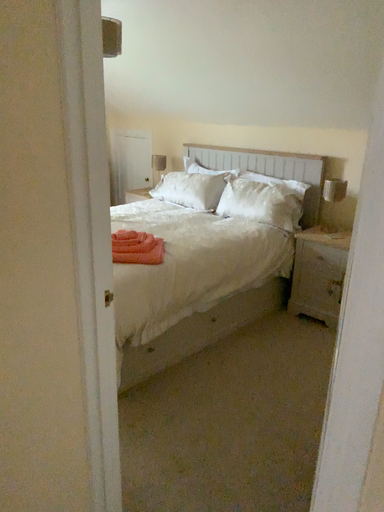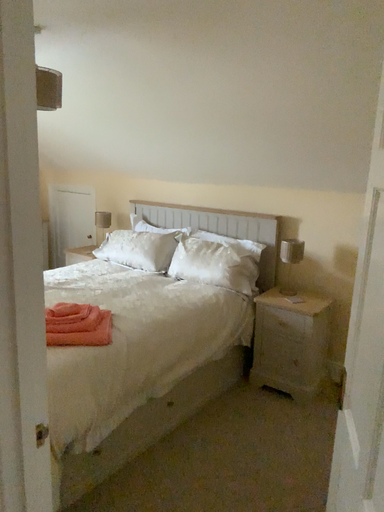
Question: Which way did the camera rotate in the video?

Choices:
 (A) rotated right
 (B) rotated left

Answer: (A)